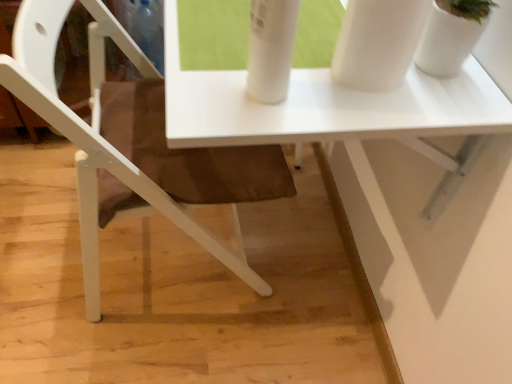
Where is `space that is in front of white glossy vase at upper right`? This screenshot has height=384, width=512. space that is in front of white glossy vase at upper right is located at coordinates (440, 110).